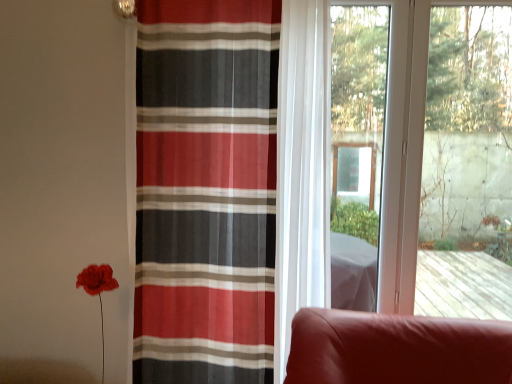
Locate an element on the screen. striped sheer curtain at center is located at coordinates (205, 190).

What do you see at coordinates (205, 190) in the screenshot? Image resolution: width=512 pixels, height=384 pixels. I see `striped sheer curtain at center` at bounding box center [205, 190].

The width and height of the screenshot is (512, 384). What are the coordinates of `transparent glass window at center` in the screenshot? It's located at (404, 144).

Describe the element at coordinates (404, 144) in the screenshot. I see `transparent glass window at center` at that location.

Measure the distance between point (397, 99) and camera.

Point (397, 99) and camera are 1.99 meters apart.

Identify the location of striped sheer curtain at center. (205, 190).

Does transparent glass window at center appear on the left side of striped sheer curtain at center?

No, transparent glass window at center is not to the left of striped sheer curtain at center.

In the image, is transparent glass window at center positioned in front of or behind striped sheer curtain at center?

transparent glass window at center is behind striped sheer curtain at center.

Considering the points (388, 305) and (237, 102), which point is in front, point (388, 305) or point (237, 102)?

Positioned in front is point (237, 102).

From the image's perspective, which one is positioned higher, transparent glass window at center or striped sheer curtain at center?

transparent glass window at center.

From a real-world perspective, which is physically above, transparent glass window at center or striped sheer curtain at center?

From a 3D spatial view, transparent glass window at center is above.

Consider the image. Is transparent glass window at center wider or thinner than striped sheer curtain at center?

Clearly, transparent glass window at center has less width compared to striped sheer curtain at center.

Can you confirm if transparent glass window at center is taller than striped sheer curtain at center?

In fact, transparent glass window at center may be shorter than striped sheer curtain at center.

From the picture: Is transparent glass window at center smaller than striped sheer curtain at center?

Yes, transparent glass window at center is smaller than striped sheer curtain at center.

Consider the image. Is transparent glass window at center not inside striped sheer curtain at center?

Absolutely, transparent glass window at center is external to striped sheer curtain at center.

Is the surface of transparent glass window at center in direct contact with striped sheer curtain at center?

No, transparent glass window at center is not in contact with striped sheer curtain at center.

Is striped sheer curtain at center at the back of transparent glass window at center?

No.

How many degrees apart are the facing directions of transparent glass window at center and striped sheer curtain at center?

The angular difference between transparent glass window at center and striped sheer curtain at center is 2.83 degrees.

Where is `window that appears on the right of striped sheer curtain at center`? window that appears on the right of striped sheer curtain at center is located at coordinates (404, 144).

Considering the relative positions of striped sheer curtain at center and transparent glass window at center in the image provided, is striped sheer curtain at center to the left of transparent glass window at center from the viewer's perspective?

Yes, striped sheer curtain at center is to the left of transparent glass window at center.

Between striped sheer curtain at center and transparent glass window at center, which one is positioned in front?

striped sheer curtain at center is more forward.

Does point (267, 359) come farther from viewer compared to point (417, 37)?

No, it is in front of (417, 37).

From the image's perspective, is striped sheer curtain at center located beneath transparent glass window at center?

Yes, from the image's perspective, striped sheer curtain at center is below transparent glass window at center.

From a real-world perspective, is striped sheer curtain at center physically located above or below transparent glass window at center?

Clearly, from a real-world perspective, striped sheer curtain at center is below transparent glass window at center.

Which object is thinner, striped sheer curtain at center or transparent glass window at center?

transparent glass window at center.

Who is shorter, striped sheer curtain at center or transparent glass window at center?

With less height is transparent glass window at center.

Based on their sizes in the image, would you say striped sheer curtain at center is bigger or smaller than transparent glass window at center?

Considering their sizes, striped sheer curtain at center takes up more space than transparent glass window at center.

Can transparent glass window at center be found inside striped sheer curtain at center?

Actually, transparent glass window at center is outside striped sheer curtain at center.

Would you consider striped sheer curtain at center to be distant from transparent glass window at center?

striped sheer curtain at center is near transparent glass window at center, not far away.

Is striped sheer curtain at center oriented towards transparent glass window at center?

No, striped sheer curtain at center does not turn towards transparent glass window at center.

Can you tell me how much striped sheer curtain at center and transparent glass window at center differ in facing direction?

The angular difference between striped sheer curtain at center and transparent glass window at center is 2.83 degrees.

Measure the distance from striped sheer curtain at center to transparent glass window at center.

striped sheer curtain at center is 82.27 centimeters away from transparent glass window at center.

You are a GUI agent. You are given a task and a screenshot of the screen. Output one action in this format:
    pyautogui.click(x=<x>, y=<y>)
    Task: Click on the window positioned vertically above the striped sheer curtain at center (from a real-world perspective)
    Image resolution: width=512 pixels, height=384 pixels.
    Given the screenshot: What is the action you would take?
    pyautogui.click(x=404, y=144)

The width and height of the screenshot is (512, 384). What are the coordinates of `window located above the striped sheer curtain at center (from the image's perspective)` in the screenshot? It's located at (404, 144).

Identify the location of window positioned vertically above the striped sheer curtain at center (from a real-world perspective). (404, 144).